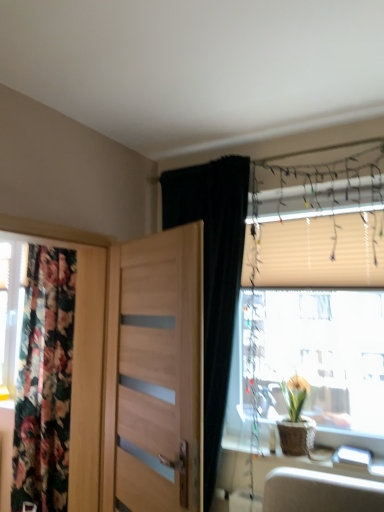
Locate an element on the screen. The width and height of the screenshot is (384, 512). vacant region below matte brown pot at window (from a real-world perspective) is located at coordinates (298, 457).